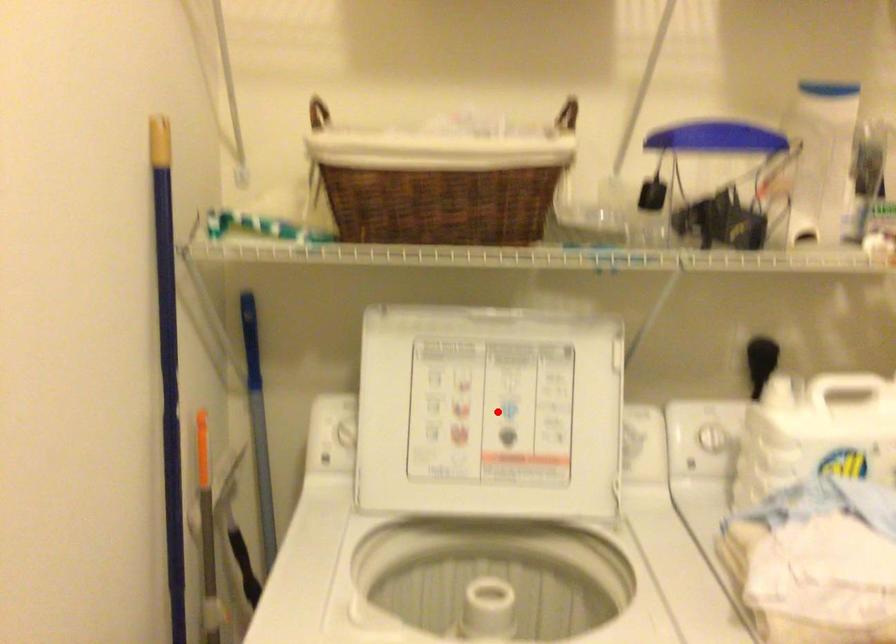
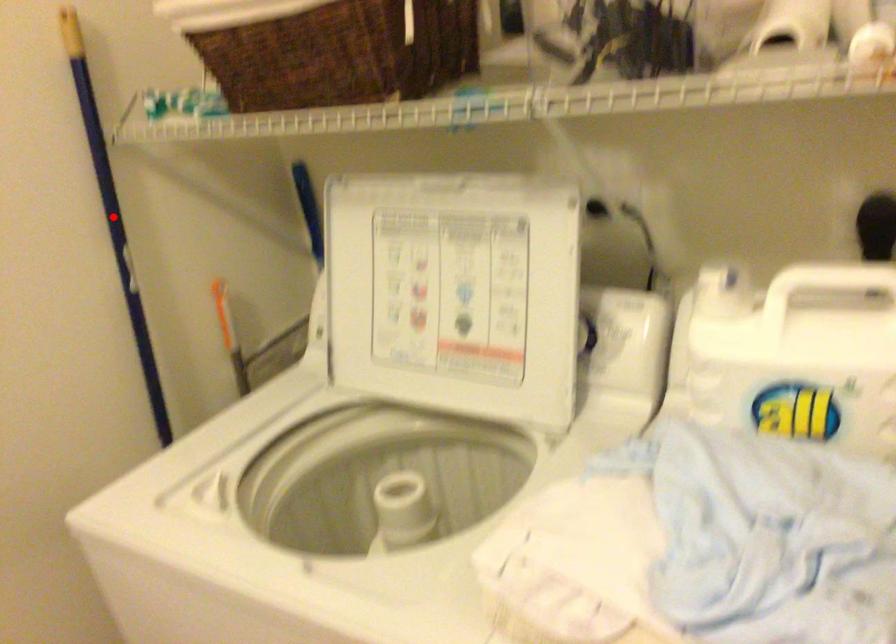
I am providing you with two images of the same scene from different viewpoints. A red point is marked on the first image and another point is marked on the second image. Are the points marked in image1 and image2 representing the same 3D position?

No